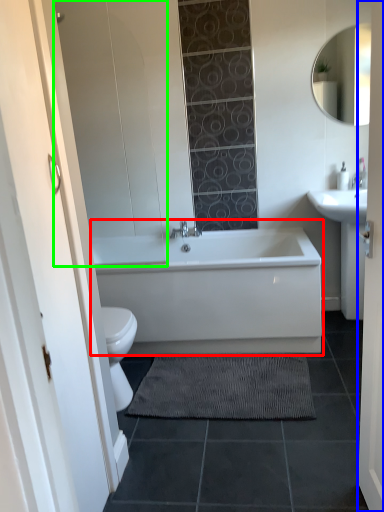
Question: Estimate the real-world distances between objects in this image. Which object is farther from bathtub (highlighted by a red box), door (highlighted by a blue box) or glass door (highlighted by a green box)?

Choices:
 (A) door
 (B) glass door

Answer: (A)